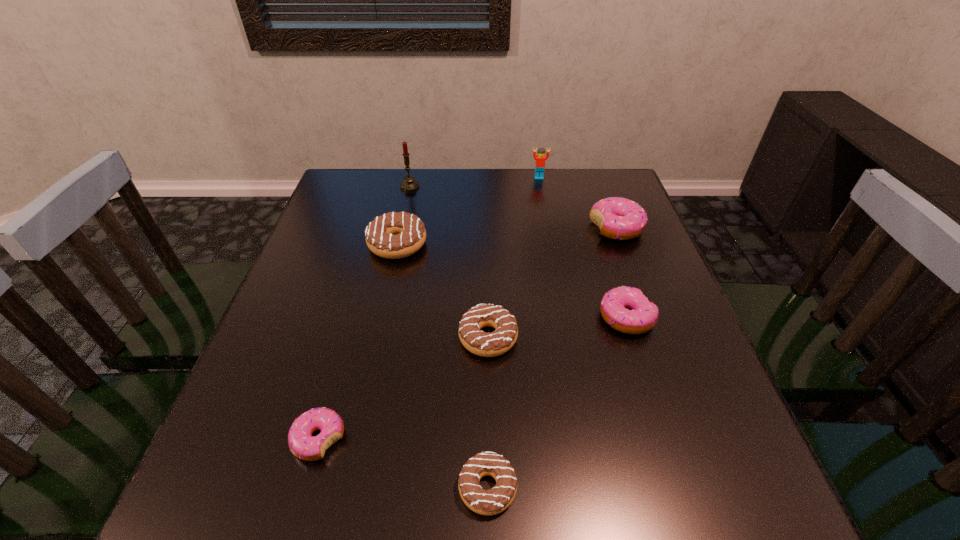
I want to click on doughnut that stands as the second closest to the biggest pink doughnut, so click(x=478, y=342).

Identify which doughnut is the fifth nearest to the second smallest chocolate doughnut. Please provide its 2D coordinates. Your answer should be formatted as a tuple, i.e. [(x, y)], where the tuple contains the x and y coordinates of a point satisfying the conditions above.

[(618, 218)]

Find the location of `pink doughnut object that ranks as the closest to the second farthest pink doughnut`. pink doughnut object that ranks as the closest to the second farthest pink doughnut is located at coordinates (618, 218).

Where is `pink doughnut that is the second closest to the farthest object`? This screenshot has height=540, width=960. pink doughnut that is the second closest to the farthest object is located at coordinates (642, 315).

Where is `chocolate doughnut that is the second nearest to the second nearest chocolate doughnut`? The image size is (960, 540). chocolate doughnut that is the second nearest to the second nearest chocolate doughnut is located at coordinates (493, 501).

Locate which chocolate doughnut is the closest to the tallest object. Please provide its 2D coordinates. Your answer should be formatted as a tuple, i.e. [(x, y)], where the tuple contains the x and y coordinates of a point satisfying the conditions above.

[(394, 235)]

At what (x,y) coordinates should I click in order to perform the action: click on vacant point that satisfies the following two spatial constraints: 1. on the back side of the nearest pink doughnut; 2. on the right side of the second nearest pink doughnut. Please return your answer as a coordinate pair (x, y). Looking at the image, I should click on (x=353, y=318).

Identify the location of vacant space that satisfies the following two spatial constraints: 1. on the front side of the second farthest chocolate doughnut; 2. on the right side of the leftmost chocolate doughnut. The width and height of the screenshot is (960, 540). (377, 338).

Locate an element on the screen. This screenshot has height=540, width=960. vacant space that satisfies the following two spatial constraints: 1. on the back side of the nearest chocolate doughnut; 2. on the right side of the second farthest chocolate doughnut is located at coordinates tap(486, 338).